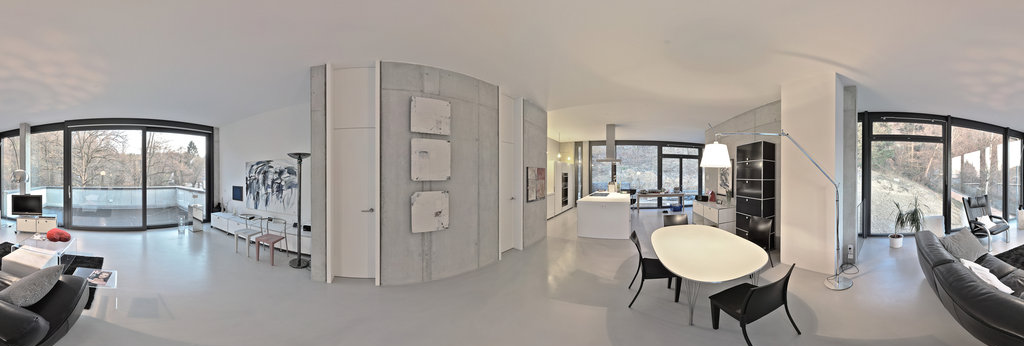
This screenshot has height=346, width=1024. Identify the location of smaller chairs. (274, 238).